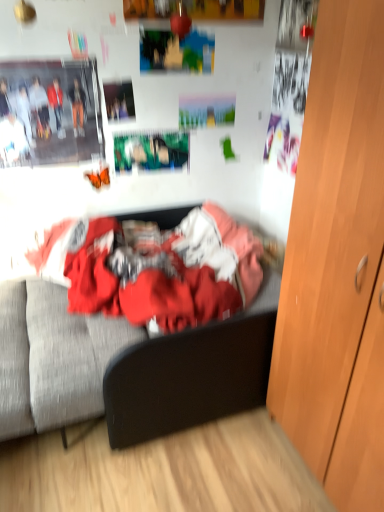
Question: Could you tell me if wooden cabinet at right is facing textured fabric bed at center?

Choices:
 (A) no
 (B) yes

Answer: (A)

Question: Is wooden cabinet at right positioned in front of textured fabric bed at center?

Choices:
 (A) yes
 (B) no

Answer: (A)

Question: Is textured fabric bed at center surrounded by wooden cabinet at right?

Choices:
 (A) no
 (B) yes

Answer: (A)

Question: From the image's perspective, is wooden cabinet at right over textured fabric bed at center?

Choices:
 (A) yes
 (B) no

Answer: (B)

Question: Considering the relative sizes of wooden cabinet at right and textured fabric bed at center in the image provided, is wooden cabinet at right taller than textured fabric bed at center?

Choices:
 (A) no
 (B) yes

Answer: (B)

Question: Is wooden cabinet at right located outside textured fabric bed at center?

Choices:
 (A) no
 (B) yes

Answer: (B)

Question: Considering the relative sizes of textured fabric bed at center and wooden cabinet at right in the image provided, is textured fabric bed at center smaller than wooden cabinet at right?

Choices:
 (A) yes
 (B) no

Answer: (A)

Question: Is textured fabric bed at center wider than wooden cabinet at right?

Choices:
 (A) yes
 (B) no

Answer: (A)

Question: Can you confirm if textured fabric bed at center is bigger than wooden cabinet at right?

Choices:
 (A) yes
 (B) no

Answer: (B)

Question: Is textured fabric bed at center oriented towards wooden cabinet at right?

Choices:
 (A) yes
 (B) no

Answer: (B)

Question: Is textured fabric bed at center outside of wooden cabinet at right?

Choices:
 (A) no
 (B) yes

Answer: (B)

Question: Is the surface of textured fabric bed at center in direct contact with wooden cabinet at right?

Choices:
 (A) no
 (B) yes

Answer: (A)

Question: Based on their sizes in the image, would you say textured fabric bed at center is bigger or smaller than wooden cabinet at right?

Choices:
 (A) small
 (B) big

Answer: (A)